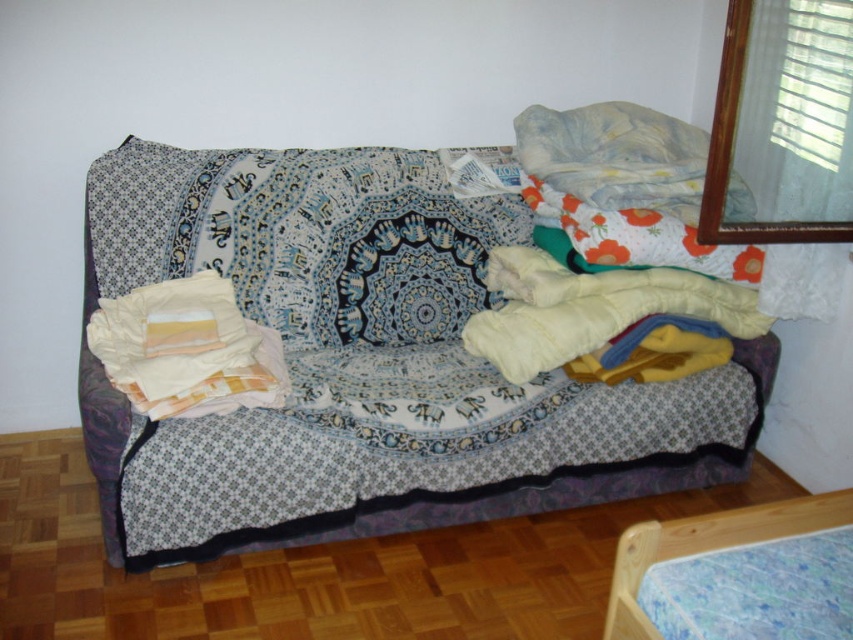
You are standing in the living room corner and want to place a small plant between the two points, point 1 at point (x=189, y=410) and point 2 at point (x=769, y=520). Which point should the plant be closer to so that it is in front of the sofa?

The plant should be closer to point 2 at (x=769, y=520) because point 1 at (x=189, y=410) is behind point 2, so placing it near point 2 keeps it in front of the sofa.

You are organizing the living room and want to place a new decorative pillow on top of the patterned fabric couch at center. However, there is already a fluffy white pillow at center. Can you place the new pillow on the couch without moving the existing fluffy white pillow?

The patterned fabric couch at center is positioned under the fluffy white pillow at center, meaning the pillow is already on the couch. Therefore, you can place the new pillow on the couch alongside the existing fluffy white pillow at center as long as there is space.

Consider the image. You are a guest in the living room and want to sit on the patterned fabric couch at center. Is the blue floral mattress at lower right underneath it a good place to sit instead?

The patterned fabric couch at center is positioned over the blue floral mattress at lower right, so the mattress is likely part of the couch structure and not a separate seating option. It would not be advisable to sit directly on the mattress as it is under the couch.